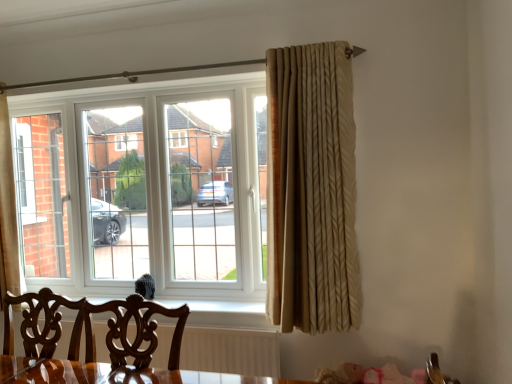
Question: From a real-world perspective, relative to white plastic window at center, is beige textured curtain at right vertically above or below?

Choices:
 (A) above
 (B) below

Answer: (A)

Question: Considering the positions of beige textured curtain at right and white plastic window at center in the image, is beige textured curtain at right bigger or smaller than white plastic window at center?

Choices:
 (A) big
 (B) small

Answer: (B)

Question: Which is nearer to the mahogany wood swivel chair at lower left?

Choices:
 (A) white plastic window at center
 (B) beige textured curtain at right
 (C) mahogany wood chair at lower center

Answer: (C)

Question: Which object is the farthest from the mahogany wood chair at lower center?

Choices:
 (A) beige textured curtain at right
 (B) white plastic window at center
 (C) mahogany wood swivel chair at lower left

Answer: (B)